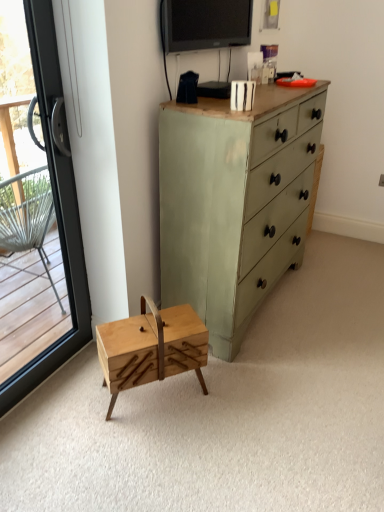
Question: In terms of size, does natural wood sewing box at center appear bigger or smaller than green painted wood chest of drawers at center?

Choices:
 (A) big
 (B) small

Answer: (B)

Question: Looking at their shapes, would you say natural wood sewing box at center is wider or thinner than green painted wood chest of drawers at center?

Choices:
 (A) thin
 (B) wide

Answer: (A)

Question: Based on their relative distances, which object is nearer to the matte black tv at upper center?

Choices:
 (A) natural wood sewing box at center
 (B) transparent glass door at left
 (C) green painted wood chest of drawers at center

Answer: (C)

Question: Estimate the real-world distances between objects in this image. Which object is farther from the natural wood sewing box at center?

Choices:
 (A) transparent glass door at left
 (B) green painted wood chest of drawers at center
 (C) matte black tv at upper center

Answer: (C)